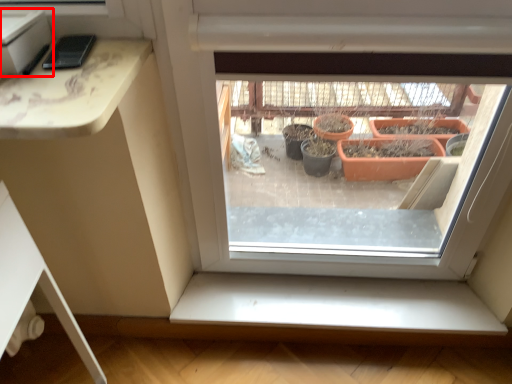
Question: From the image's perspective, what is the correct spatial positioning of window box (annotated by the red box) in reference to window sill?

Choices:
 (A) above
 (B) below

Answer: (A)